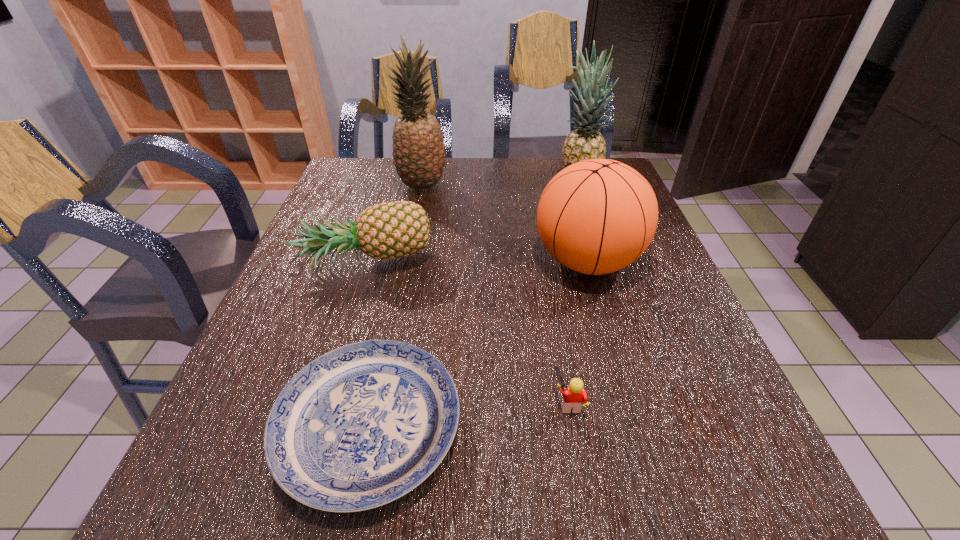
The image size is (960, 540). In the image, there is a desktop. In order to click on blank space at the far edge in this screenshot , I will do `click(492, 158)`.

Where is `free space at the near edge`? The height and width of the screenshot is (540, 960). free space at the near edge is located at coordinates (426, 485).

The width and height of the screenshot is (960, 540). In order to click on vacant space at the left edge of the desktop in this screenshot , I will do `click(312, 276)`.

Where is `free space at the right edge`? free space at the right edge is located at coordinates (639, 330).

Find the location of `vacant space at the near left corner`. vacant space at the near left corner is located at coordinates (247, 519).

This screenshot has width=960, height=540. Find the location of `free point between the basketball and the Lego`. free point between the basketball and the Lego is located at coordinates (578, 332).

The height and width of the screenshot is (540, 960). What are the coordinates of `blank region between the shortest object and the Lego` in the screenshot? It's located at (468, 414).

Where is `free space between the second shortest object and the rightmost pineapple`? The height and width of the screenshot is (540, 960). free space between the second shortest object and the rightmost pineapple is located at coordinates (573, 290).

Image resolution: width=960 pixels, height=540 pixels. I want to click on vacant region between the second shortest object and the plate, so click(x=468, y=414).

Where is `free space between the basketball and the shortest object`? The height and width of the screenshot is (540, 960). free space between the basketball and the shortest object is located at coordinates (478, 344).